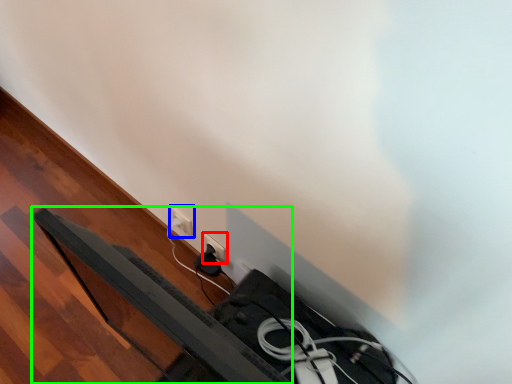
Question: Based on their relative distances, which object is nearer to power plugs and sockets (highlighted by a red box)? Choose from power plugs and sockets (highlighted by a blue box) and bed frame (highlighted by a green box).

Choices:
 (A) power plugs and sockets
 (B) bed frame

Answer: (A)